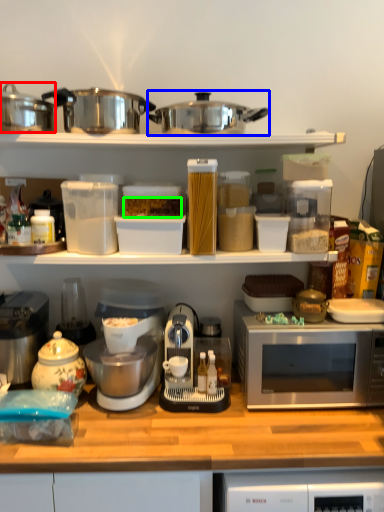
Question: Which is nearer to the kitchen appliance (highlighted by a red box)? crock pot (highlighted by a blue box) or food (highlighted by a green box).

Choices:
 (A) crock pot
 (B) food

Answer: (B)